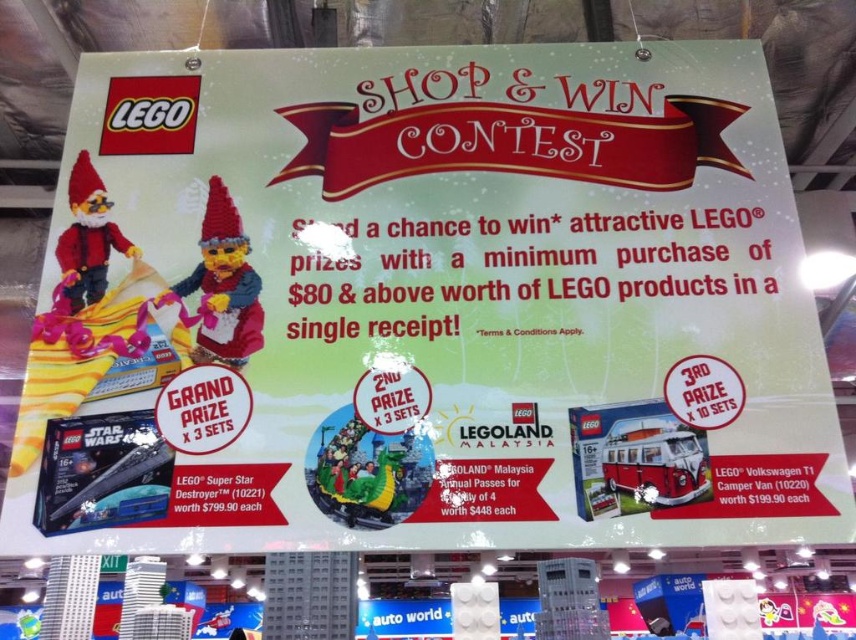
You are looking at the promotional poster for the LEGO contest. You see the red matte lego volkswagen t1 camper van at center and the matte plastic gnome at upper left. Which prize is shorter?

The red matte lego volkswagen t1 camper van at center is shorter than the matte plastic gnome at upper left.

Looking at the promotional poster for the LEGO contest, you see the knitted woolen gnome at center and the red matte lego volkswagen t1 camper van at center. Which of these two items is taller?

The knitted woolen gnome at center is taller than the red matte lego volkswagen t1 camper van at center.